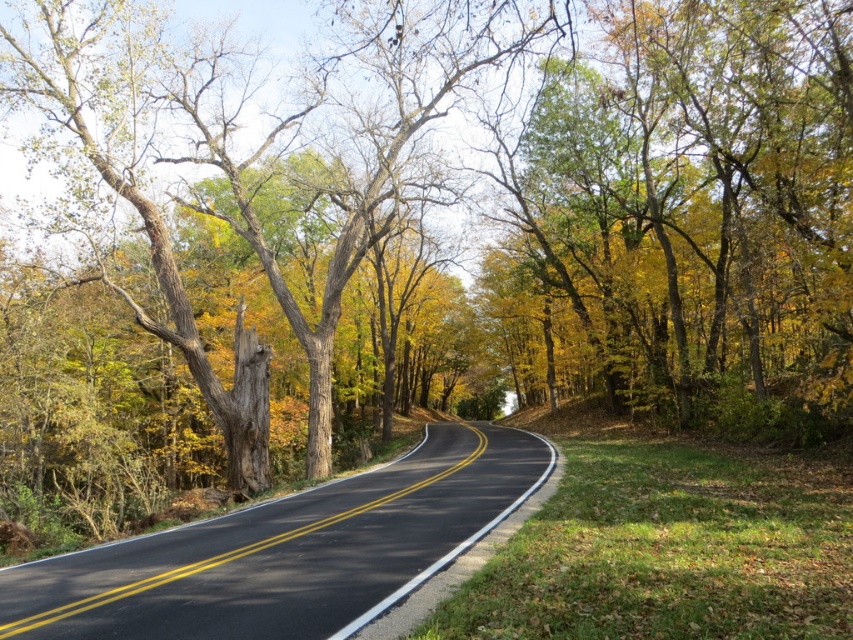
You are driving a car and want to know if there is an obstacle blocking your path ahead. Based on the scene, is the green leafy tree at upper right closer to you than the black asphalt highway at center?

The green leafy tree at upper right is further to the viewer than the black asphalt highway at center, so it is not blocking your path as the highway is closer.

You are driving along the black asphalt highway at center and notice a green leafy tree at upper right. From your perspective, which side of the highway is the tree located?

The green leafy tree at upper right is positioned on the right side of the black asphalt highway at center, so it is on the right side.